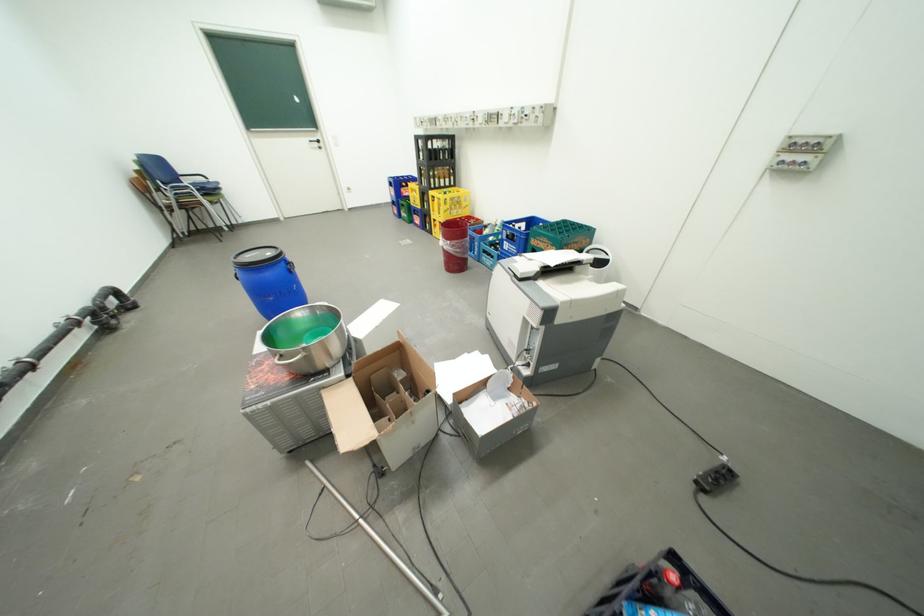
Where is `red plastic bucket`? This screenshot has width=924, height=616. red plastic bucket is located at coordinates (455, 244).